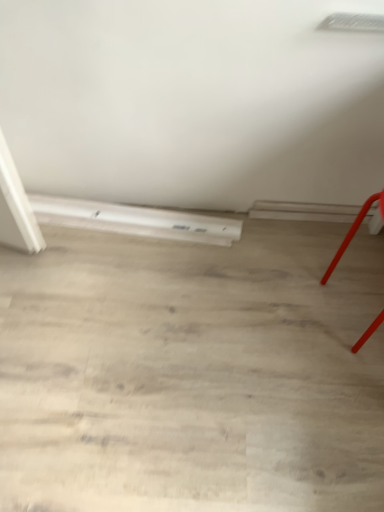
Question: From a real-world perspective, is smooth red chair at right physically located above or below white matte heater at lower left?

Choices:
 (A) below
 (B) above

Answer: (B)

Question: Considering the positions of smooth red chair at right and white matte heater at lower left in the image, is smooth red chair at right taller or shorter than white matte heater at lower left?

Choices:
 (A) tall
 (B) short

Answer: (A)

Question: In the image, is smooth red chair at right on the left side or the right side of white matte heater at lower left?

Choices:
 (A) left
 (B) right

Answer: (B)

Question: Is point (44, 222) closer or farther from the camera than point (352, 226)?

Choices:
 (A) farther
 (B) closer

Answer: (A)

Question: Considering the positions of white matte heater at lower left and smooth red chair at right in the image, is white matte heater at lower left wider or thinner than smooth red chair at right?

Choices:
 (A) wide
 (B) thin

Answer: (B)

Question: Would you say white matte heater at lower left is inside or outside smooth red chair at right?

Choices:
 (A) inside
 (B) outside

Answer: (B)

Question: From their relative heights in the image, would you say white matte heater at lower left is taller or shorter than smooth red chair at right?

Choices:
 (A) tall
 (B) short

Answer: (B)